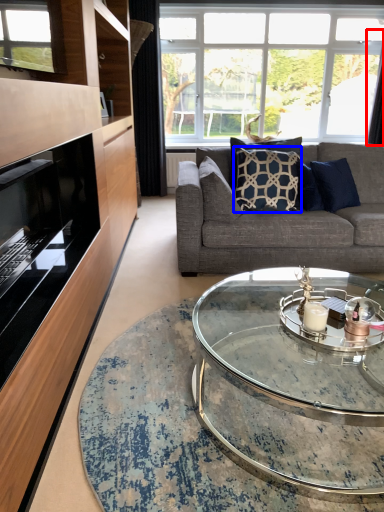
Question: Which object is further to the camera taking this photo, curtain (highlighted by a red box) or pillow (highlighted by a blue box)?

Choices:
 (A) curtain
 (B) pillow

Answer: (A)